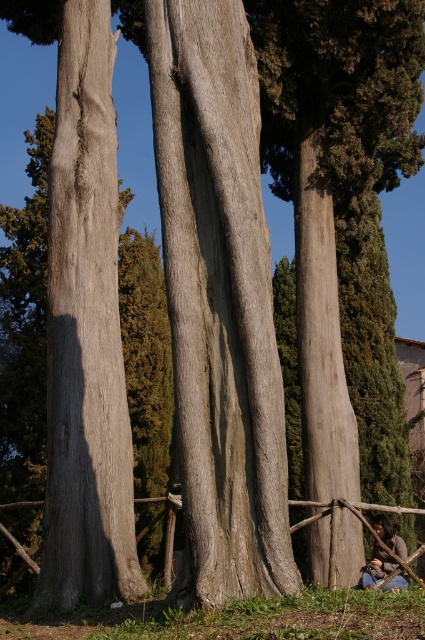
You are standing in the middle of the scene and see the smooth gray tree trunk at center and the wooden at center. Which object is positioned to the right of the other?

The smooth gray tree trunk at center is to the right of wooden at center.

You are a painter setting up an easel to paint the three tree trunks. You notice the smooth gray tree trunk at center and the wooden at center. Which tree trunk is wider?

The smooth gray tree trunk at center is wider than the wooden at center.

You are standing at the center of the scene and want to locate the gray rough bark tree trunk at left. Which direction should you look to find it?

You should look to the left to find the gray rough bark tree trunk at left.